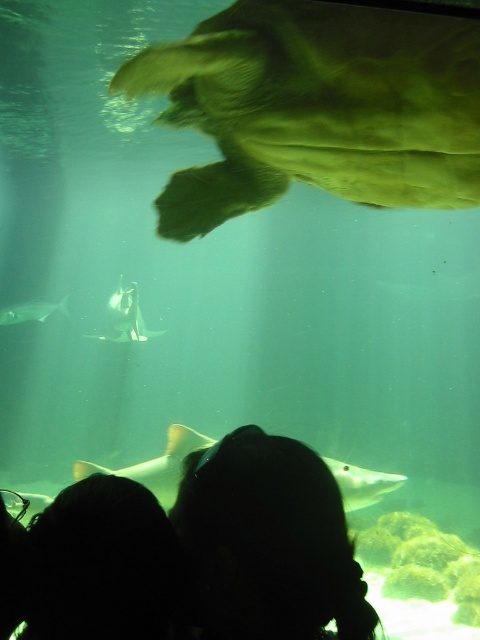
You are an underwater photographer aiming to capture a clear shot of the sharks. You notice two silhouettes of people below you in the aquarium. Which silhouette hair is closer to the camera, the silhouette hair at lower center or the silhouette hair at lower left?

The silhouette hair at lower center is closer to the camera because the silhouette hair at lower left is behind it, meaning the lower center one is in front and thus nearer to the photographer.